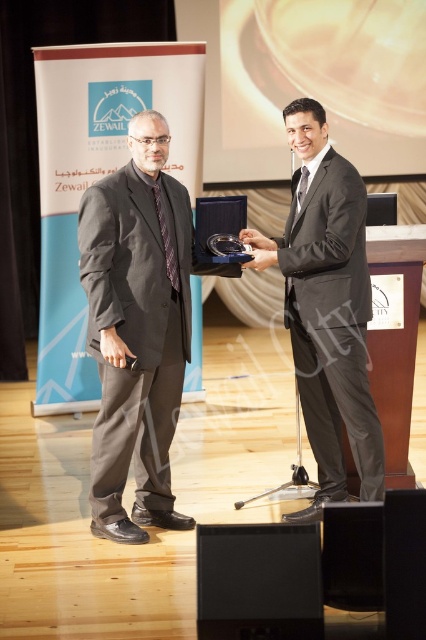
You are a photographer at the event and need to take a photo of both the matte black suit at left and the shiny black suit at center. Since the camera can only focus on one subject at a time, which subject should you focus on first to ensure both suits are in focus?

The matte black suit at left is closer to the viewer than the shiny black suit at center. To ensure both are in focus, focus on the shiny black suit at center because it is farther away, allowing the depth of field to cover the closer matte black suit at left as well.

What is the relationship between the sizes of the matte black suit at left and the shiny black suit at center?

The matte black suit at left is larger in size than the shiny black suit at center.